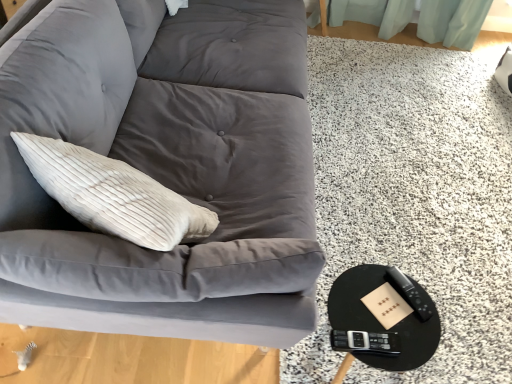
The width and height of the screenshot is (512, 384). What are the coordinates of `free spot to the left of black plastic remote at lower right` in the screenshot? It's located at (367, 296).